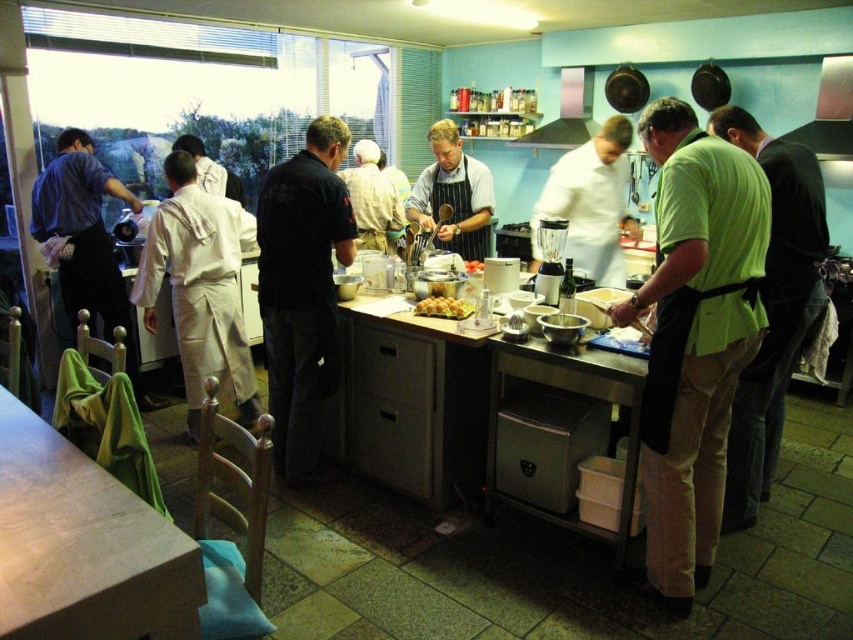
Can you confirm if matte black apron at left is smaller than metallic silver exhaust hood at upper center?

No, matte black apron at left is not smaller than metallic silver exhaust hood at upper center.

Which is below, matte black apron at left or metallic silver exhaust hood at upper center?

matte black apron at left

Locate an element on the screen. The height and width of the screenshot is (640, 853). matte black apron at left is located at coordinates (86, 243).

Does green apron at center have a greater width compared to metallic silver exhaust hood at upper right?

Yes, green apron at center is wider than metallic silver exhaust hood at upper right.

The width and height of the screenshot is (853, 640). Identify the location of green apron at center. (773, 308).

Where is `green apron at center`? This screenshot has width=853, height=640. green apron at center is located at coordinates (773, 308).

Which is above, green apron at center or golden brown pastry at center?

golden brown pastry at center is higher up.

Who is positioned more to the right, green apron at center or golden brown pastry at center?

Positioned to the right is green apron at center.

At what (x,y) coordinates should I click in order to perform the action: click on green apron at center. Please return your answer as a coordinate pair (x, y). Looking at the image, I should click on (773, 308).